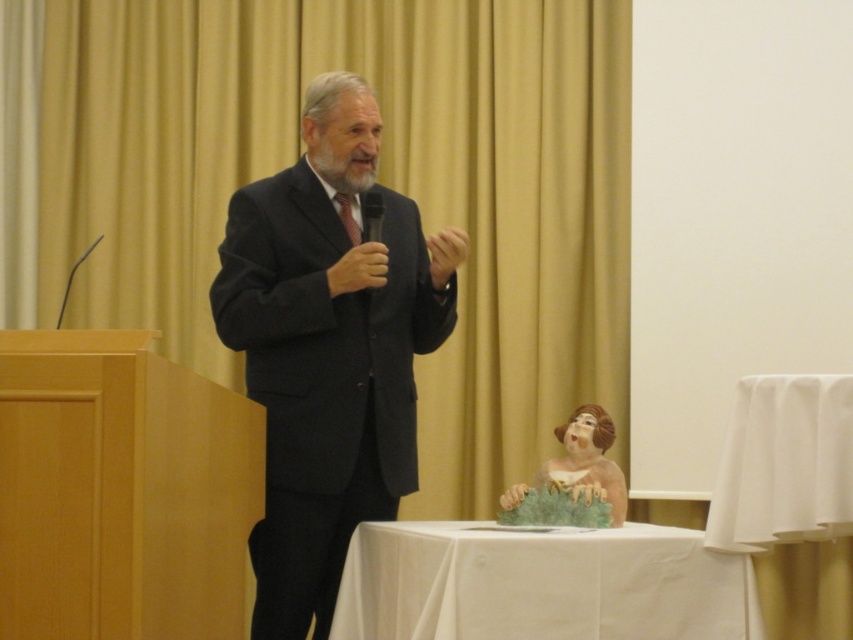
Is point (387, 502) positioned behind point (346, 616)?

Yes, point (387, 502) is behind point (346, 616).

This screenshot has width=853, height=640. What do you see at coordinates (328, 348) in the screenshot?
I see `dark gray suit at center` at bounding box center [328, 348].

Locate an element on the screen. dark gray suit at center is located at coordinates (328, 348).

Is point (485, 234) positioned in front of point (376, 236)?

No, it is not.

The image size is (853, 640). What are the coordinates of `matte yellow curtain at upper center` in the screenshot? It's located at (380, 180).

Is point (399, 492) less distant than point (74, 269)?

Yes, it is in front of point (74, 269).

Consider the image. Is dark gray suit at center further to camera compared to metallic wire at left?

Yes, dark gray suit at center is behind metallic wire at left.

Describe the element at coordinates (328, 348) in the screenshot. I see `dark gray suit at center` at that location.

Locate an element on the screen. The height and width of the screenshot is (640, 853). dark gray suit at center is located at coordinates (328, 348).